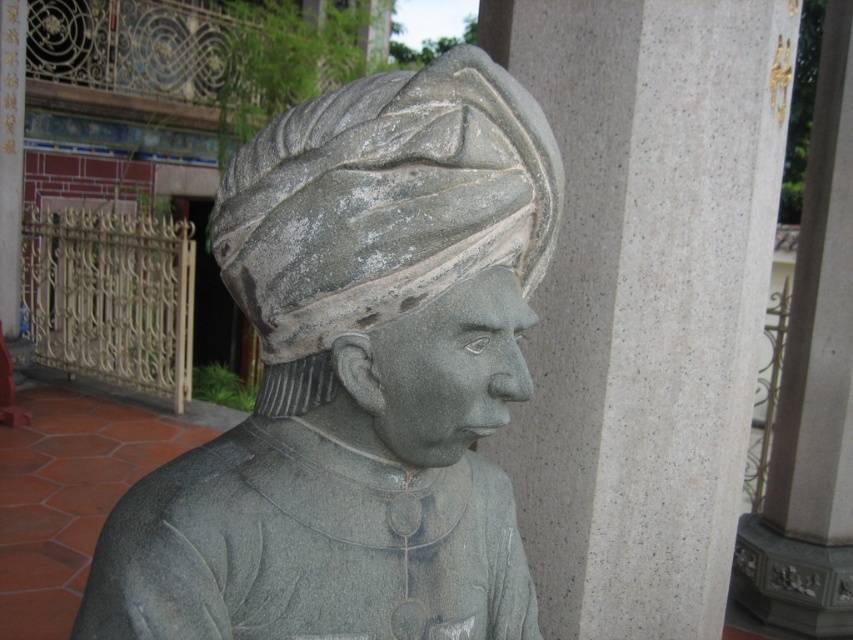
Question: Which of these objects is positioned closest to the gray stone pillar at center-right?

Choices:
 (A) gray stone statue at center
 (B) gray stone headscarf at center

Answer: (A)

Question: Does gray stone statue at center have a smaller size compared to gray stone pillar at center-right?

Choices:
 (A) no
 (B) yes

Answer: (B)

Question: Which of the following is the closest to the observer?

Choices:
 (A) (218, 257)
 (B) (693, 266)
 (C) (368, 570)

Answer: (C)

Question: Which point is closer to the camera?

Choices:
 (A) (660, 497)
 (B) (460, 314)
 (C) (505, 250)

Answer: (B)

Question: Is gray stone statue at center positioned at the back of gray stone headscarf at center?

Choices:
 (A) no
 (B) yes

Answer: (A)

Question: Considering the relative positions of gray stone pillar at center-right and gray stone headscarf at center in the image provided, where is gray stone pillar at center-right located with respect to gray stone headscarf at center?

Choices:
 (A) right
 (B) left

Answer: (A)